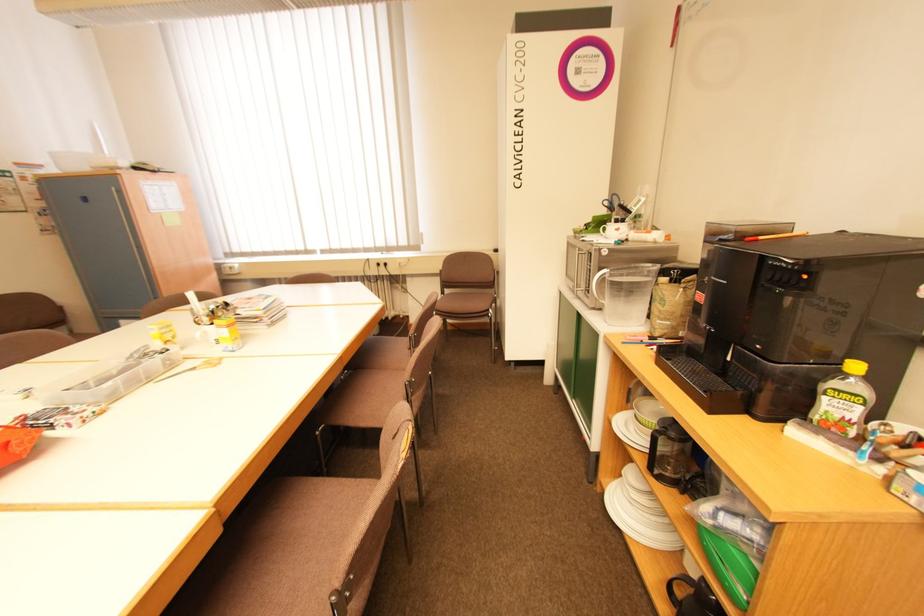
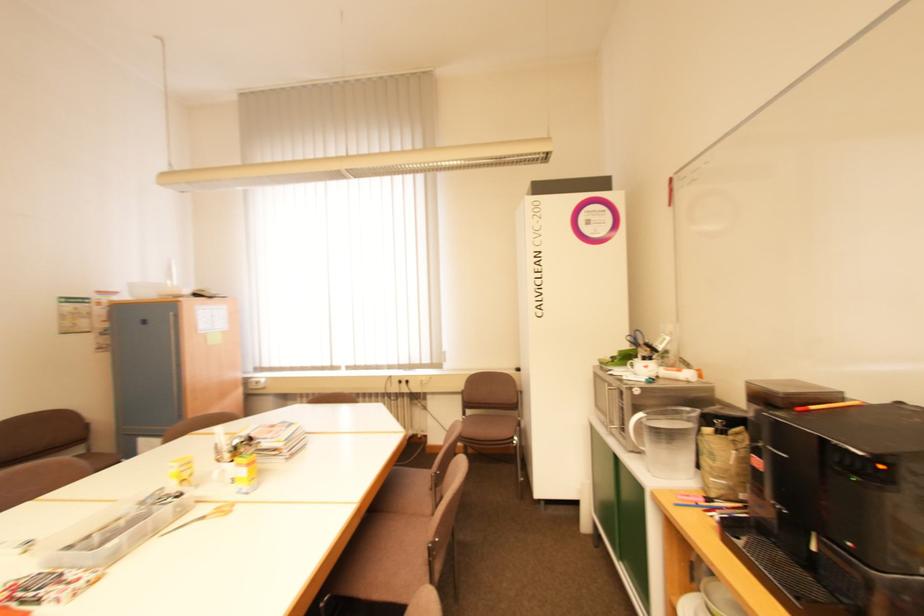
Question: The first image is from the beginning of the video and the second image is from the end. How did the camera likely rotate when shooting the video?

Choices:
 (A) Left
 (B) Right
 (C) Up
 (D) Down

Answer: (C)